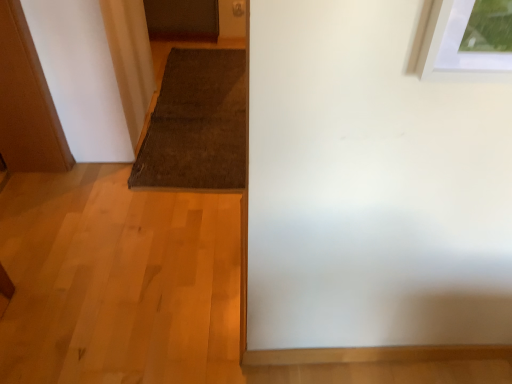
Locate an element on the screen. The image size is (512, 384). wooden door at left is located at coordinates [27, 101].

The image size is (512, 384). What do you see at coordinates (27, 101) in the screenshot? I see `wooden door at left` at bounding box center [27, 101].

Describe the element at coordinates (196, 124) in the screenshot. I see `brown textured mat at center` at that location.

Image resolution: width=512 pixels, height=384 pixels. I want to click on brown textured mat at center, so click(x=196, y=124).

Where is `wooden door at left`? The height and width of the screenshot is (384, 512). wooden door at left is located at coordinates (27, 101).

Is brown textured mat at center to the right of wooden door at left from the viewer's perspective?

Correct, you'll find brown textured mat at center to the right of wooden door at left.

From the picture: Which object is closer to the camera taking this photo, brown textured mat at center or wooden door at left?

wooden door at left is in front.

Considering the positions of point (195, 112) and point (30, 118), is point (195, 112) closer or farther from the camera than point (30, 118)?

Point (195, 112) appears to be farther away from the viewer than point (30, 118).

From the image's perspective, is brown textured mat at center below wooden door at left?

No, from the image's perspective, brown textured mat at center is not below wooden door at left.

From a real-world perspective, relative to wooden door at left, is brown textured mat at center vertically above or below?

From a real-world perspective, brown textured mat at center is physically below wooden door at left.

Consider the image. Considering the sizes of objects brown textured mat at center and wooden door at left in the image provided, who is thinner, brown textured mat at center or wooden door at left?

Thinner between the two is wooden door at left.

Considering the sizes of objects brown textured mat at center and wooden door at left in the image provided, who is shorter, brown textured mat at center or wooden door at left?

brown textured mat at center.

Can you confirm if brown textured mat at center is smaller than wooden door at left?

Yes, brown textured mat at center is smaller than wooden door at left.

Can wooden door at left be found inside brown textured mat at center?

Definitely not — wooden door at left is not inside brown textured mat at center.

Is brown textured mat at center not near wooden door at left?

That's not correct — brown textured mat at center is a little close to wooden door at left.

Is brown textured mat at center turned away from wooden door at left?

That's not correct — brown textured mat at center is not looking away from wooden door at left.

How different are the orientations of brown textured mat at center and wooden door at left in degrees?

There is a 1.64-degree angle between the facing directions of brown textured mat at center and wooden door at left.

Locate an element on the screen. The image size is (512, 384). doormat behind the wooden door at left is located at coordinates (196, 124).

Between wooden door at left and brown textured mat at center, which one appears on the right side from the viewer's perspective?

brown textured mat at center is more to the right.

Is the position of wooden door at left more distant than that of brown textured mat at center?

No.

Is point (13, 53) farther from viewer compared to point (219, 161)?

No, it is not.

From the image's perspective, between wooden door at left and brown textured mat at center, who is located below?

wooden door at left appears lower in the image.

From a real-world perspective, does wooden door at left sit lower than brown textured mat at center?

No, from a real-world perspective, wooden door at left is not under brown textured mat at center.

Is wooden door at left thinner than brown textured mat at center?

Indeed, wooden door at left has a lesser width compared to brown textured mat at center.

Which of these two, wooden door at left or brown textured mat at center, stands shorter?

With less height is brown textured mat at center.

Considering the relative sizes of wooden door at left and brown textured mat at center in the image provided, is wooden door at left smaller than brown textured mat at center?

Actually, wooden door at left might be larger than brown textured mat at center.

Is wooden door at left outside of brown textured mat at center?

Yes, wooden door at left is outside of brown textured mat at center.

Is wooden door at left far away from brown textured mat at center?

That's not correct — wooden door at left is a little close to brown textured mat at center.

Is wooden door at left facing towards brown textured mat at center?

No, wooden door at left is not aimed at brown textured mat at center.

This screenshot has height=384, width=512. What are the coordinates of `door that appears below the brown textured mat at center (from the image's perspective)` in the screenshot? It's located at (27, 101).

There is a brown textured mat at center. Where is `door above it (from a real-world perspective)`? door above it (from a real-world perspective) is located at coordinates (27, 101).

The height and width of the screenshot is (384, 512). Find the location of `door below the brown textured mat at center (from the image's perspective)`. door below the brown textured mat at center (from the image's perspective) is located at coordinates (27, 101).